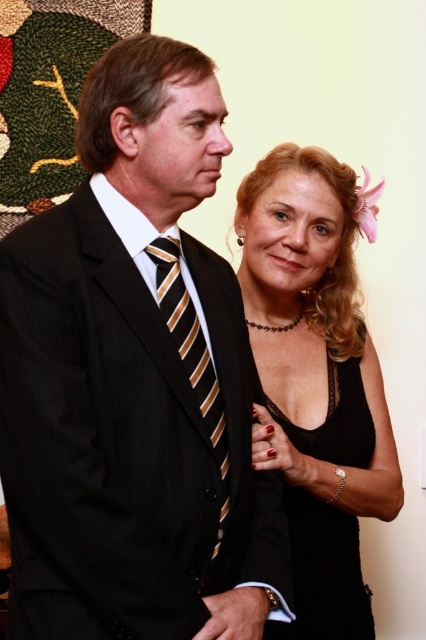
What object corresponds to the coordinates point (134, 381) in the scene?

The coordinates point (134, 381) correspond to the matte black suit at center.

You are standing in the same room as the two people in the image and want to place a small decoration exactly halfway between the two points shown as point [186,492] and point [331,339]. Will the decoration be closer to the front or the back of the scene?

The decoration placed halfway between point [186,492] and point [331,339] will be closer to the back of the scene because point [331,339] is farther from the viewer than point [186,492].

You are planning to wear both the matte black suit at center and the black lace tank top at center for an event. Based on the image, which one should you choose if you want a more formal look?

The matte black suit at center is more formal because it is a suit, while the black lace tank top at center is a tank top, which is typically less formal.